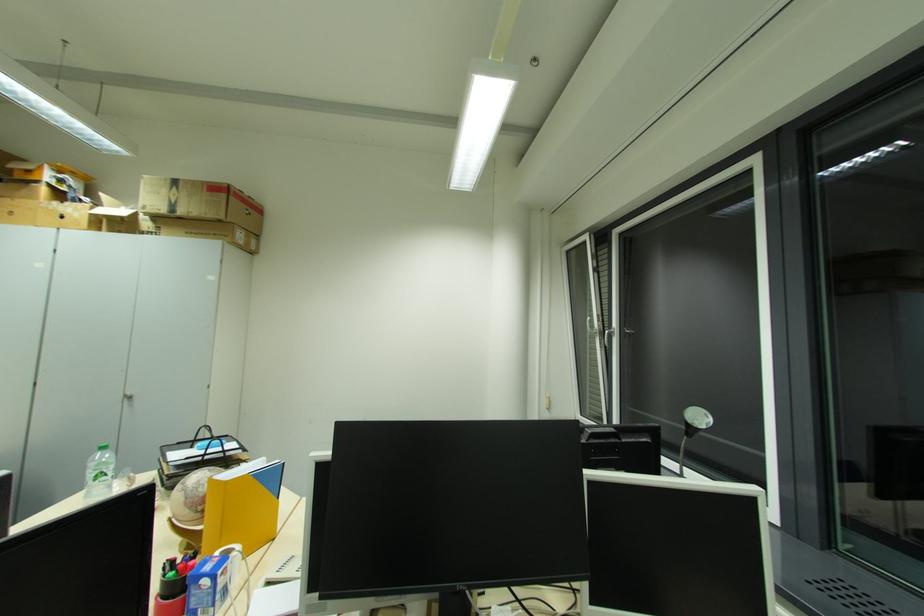
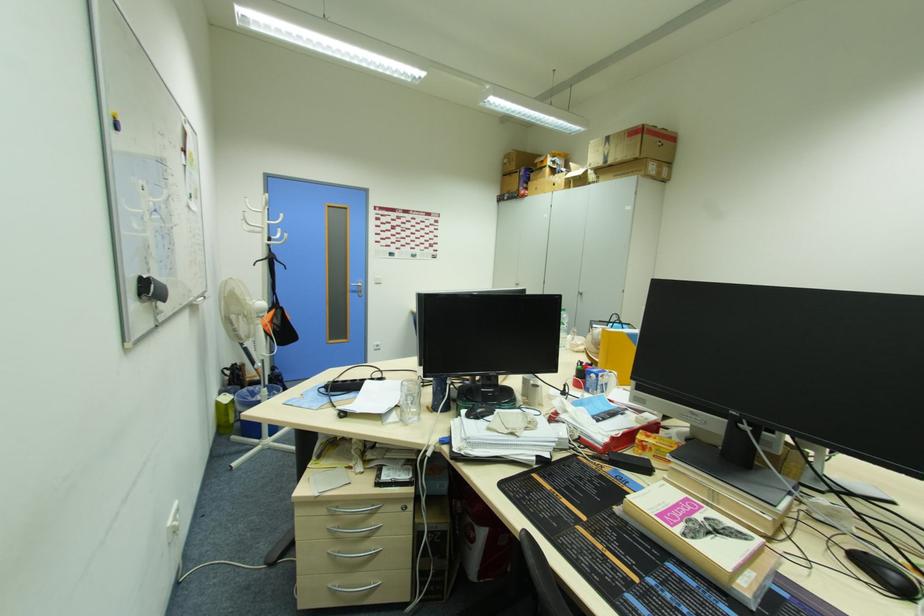
Question: The camera is either moving clockwise (left) or counter-clockwise (right) around the object. The first image is from the beginning of the video and the second image is from the end. Is the camera moving left or right when shooting the video?

Choices:
 (A) Left
 (B) Right

Answer: (B)